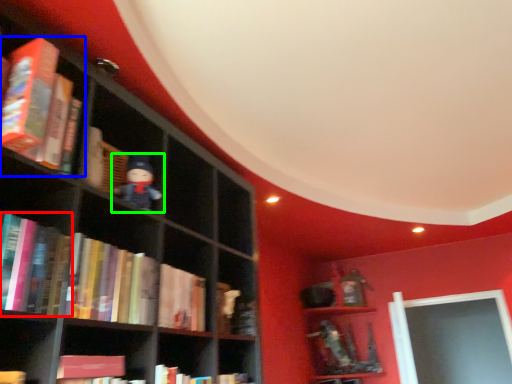
Question: Which is farther away from book (highlighted by a red box)? book (highlighted by a blue box) or toy (highlighted by a green box)?

Choices:
 (A) book
 (B) toy

Answer: (B)